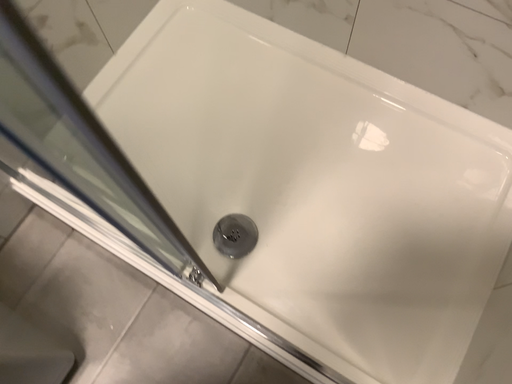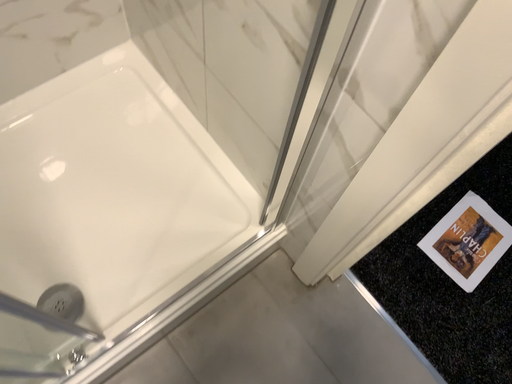
Question: Which way did the camera rotate in the video?

Choices:
 (A) rotated upward
 (B) rotated downward

Answer: (A)